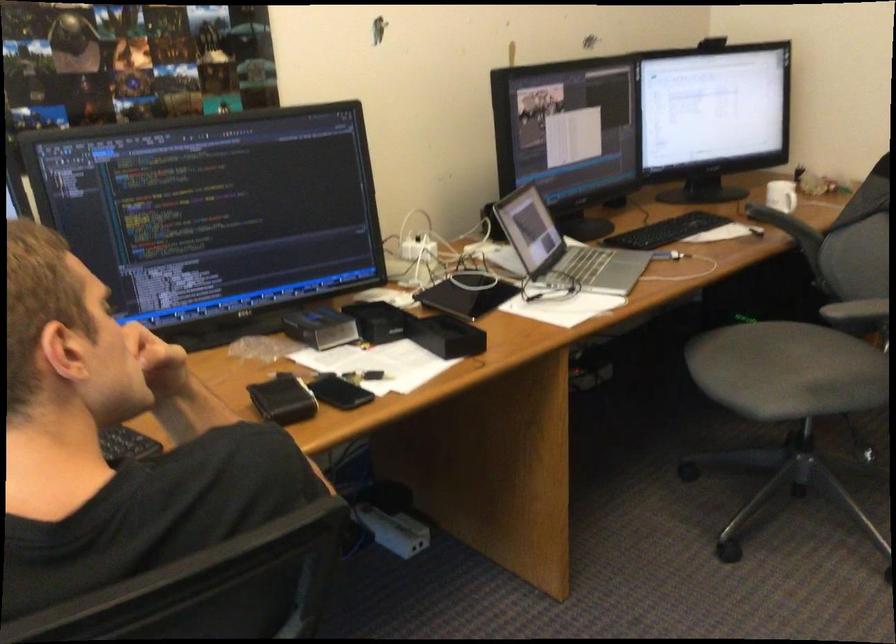
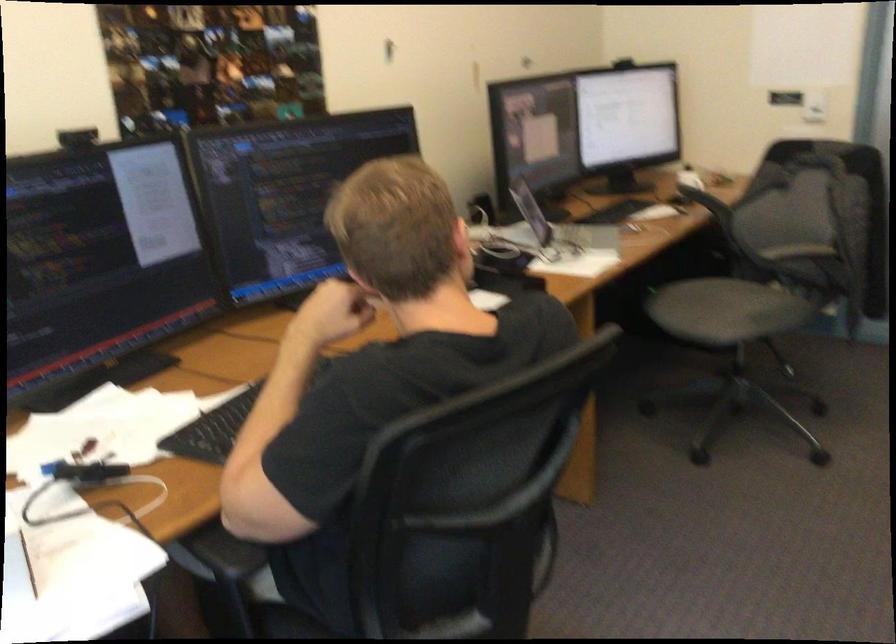
Locate, in the second image, the point that corresponds to the point at 754,381 in the first image.

(709, 308)